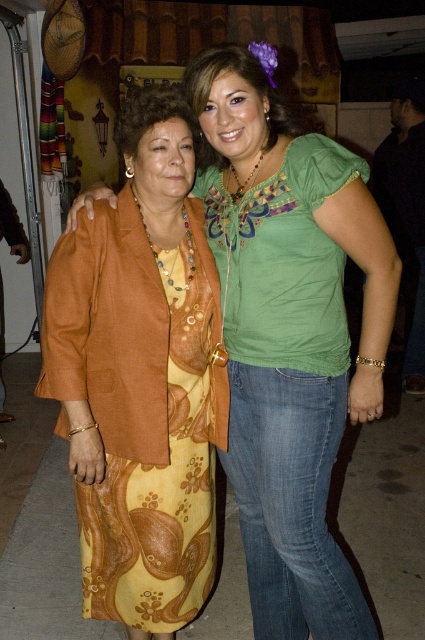
You are at a social event and want to take a photo of both the matte orange dress at center and the yellow floral dress at center. Which dress should you focus on first to ensure both are in the frame?

You should focus on the matte orange dress at center first because it is closer to the viewer than the yellow floral dress at center, ensuring both are in the frame.

You are organizing a charity event and need to decide which dress to donate. Both the matte orange dress at center and the yellow floral dress at center are available. Which dress should you choose if you want to donate the larger one?

The matte orange dress at center is bigger than the yellow floral dress at center, so you should donate the matte orange dress at center.

You are at a party and want to take a photo of both the matte orange dress at center and the yellow floral dress at center. To ensure both dresses are in the frame, should you position yourself to the left or right of the two women?

You should position yourself to the left of the two women because the matte orange dress at center is to the right of the yellow floral dress at center, so placing yourself to the left will keep both dresses in the camera frame.